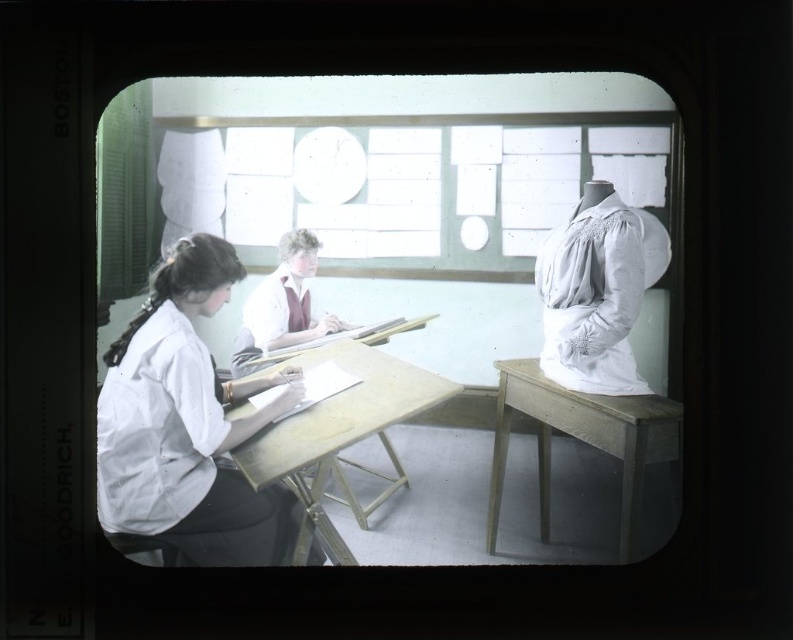
Is white cotton blouse at left thinner than wooden table at right?

In fact, white cotton blouse at left might be wider than wooden table at right.

Is white cotton blouse at left smaller than wooden table at right?

No.

Where is `white cotton blouse at left`? white cotton blouse at left is located at coordinates (184, 429).

Which is more to the left, white cotton blouse at right or wooden table at right?

wooden table at right is more to the left.

Measure the distance between white cotton blouse at right and camera.

white cotton blouse at right and camera are 4.12 feet apart from each other.

The height and width of the screenshot is (640, 793). What do you see at coordinates (592, 294) in the screenshot?
I see `white cotton blouse at right` at bounding box center [592, 294].

Find the location of a particular element. The width and height of the screenshot is (793, 640). white cotton blouse at right is located at coordinates coord(592,294).

Can you confirm if white cotton blouse at right is thinner than wooden table at center?

Indeed, white cotton blouse at right has a lesser width compared to wooden table at center.

Can you confirm if white cotton blouse at right is smaller than wooden table at center?

Correct, white cotton blouse at right occupies less space than wooden table at center.

Which is in front, point (585, 298) or point (330, 400)?

Point (585, 298) is more forward.

At what (x,y) coordinates should I click in order to perform the action: click on white cotton blouse at right. Please return your answer as a coordinate pair (x, y). The image size is (793, 640). Looking at the image, I should click on (592, 294).